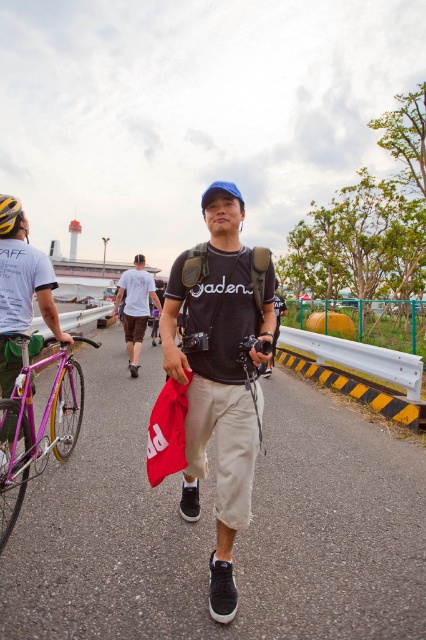
You are a photographer standing on the pathway near the lighthouse. You see a man wearing khaki cotton pants at center and a metallic purple bicycle at left. Which object is taller?

The khaki cotton pants at center is much taller than the metallic purple bicycle at left.